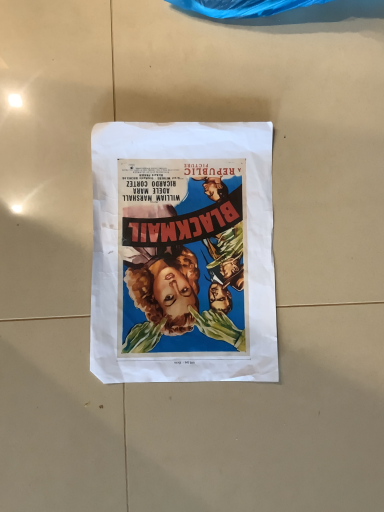
The width and height of the screenshot is (384, 512). I want to click on vintage paper poster at center, so click(x=183, y=253).

What do you see at coordinates (183, 253) in the screenshot? Image resolution: width=384 pixels, height=512 pixels. I see `vintage paper poster at center` at bounding box center [183, 253].

The image size is (384, 512). Identify the location of vintage paper poster at center. (183, 253).